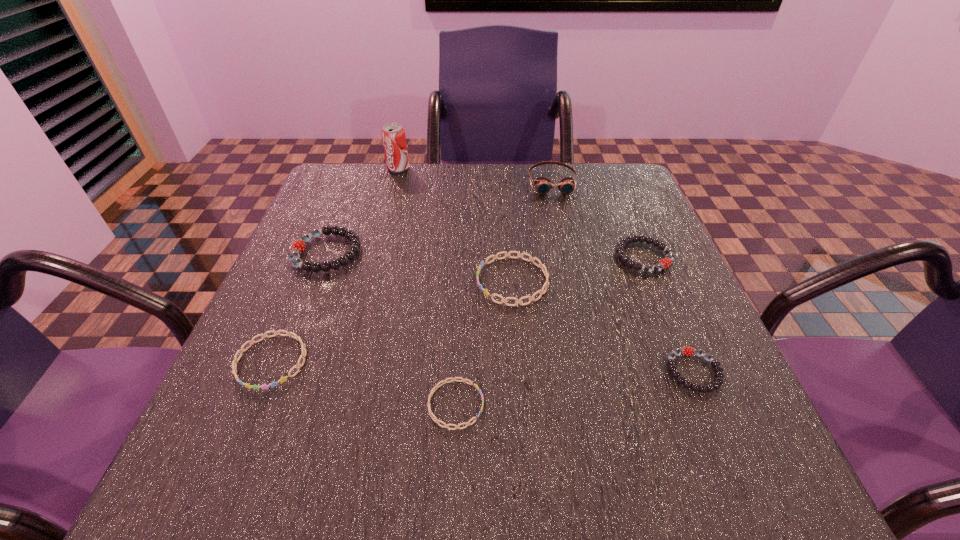
At what (x,y) coordinates should I click in order to perform the action: click on vacant space in between the second tallest object and the pink soda can. Please return your answer as a coordinate pair (x, y). Looking at the image, I should click on (475, 175).

I want to click on free space between the leftmost black bracelet and the tallest object, so click(x=363, y=211).

The width and height of the screenshot is (960, 540). In order to click on vacant area that lies between the second smallest black bracelet and the seventh shortest object in this screenshot , I will do `click(598, 219)`.

Find the location of `free spot between the second biggest black bracelet and the second smallest blue bracelet`. free spot between the second biggest black bracelet and the second smallest blue bracelet is located at coordinates (458, 309).

At what (x,y) coordinates should I click in order to perform the action: click on vacant point located between the pink soda can and the second biggest black bracelet. Please return your answer as a coordinate pair (x, y). This screenshot has width=960, height=540. Looking at the image, I should click on (521, 212).

Where is `empty space that is in between the biggest blue bracelet and the leftmost black bracelet`? The image size is (960, 540). empty space that is in between the biggest blue bracelet and the leftmost black bracelet is located at coordinates (420, 267).

This screenshot has height=540, width=960. I want to click on unoccupied area between the goggles and the farthest blue bracelet, so pos(532,232).

This screenshot has width=960, height=540. I want to click on vacant space that's between the farthest blue bracelet and the nearest black bracelet, so click(x=603, y=326).

The height and width of the screenshot is (540, 960). Identify the location of blank region between the smallest black bracelet and the second biggest black bracelet. (669, 314).

Choose which object is the second nearest neighbor to the pink soda can. Please provide its 2D coordinates. Your answer should be formatted as a tuple, i.e. [(x, y)], where the tuple contains the x and y coordinates of a point satisfying the conditions above.

[(543, 185)]